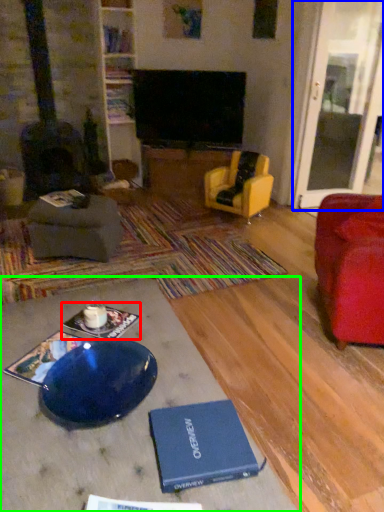
Question: Which object is positioned closest to book (highlighted by a red box)? Select from glass door (highlighted by a blue box) and table (highlighted by a green box).

Choices:
 (A) glass door
 (B) table

Answer: (B)